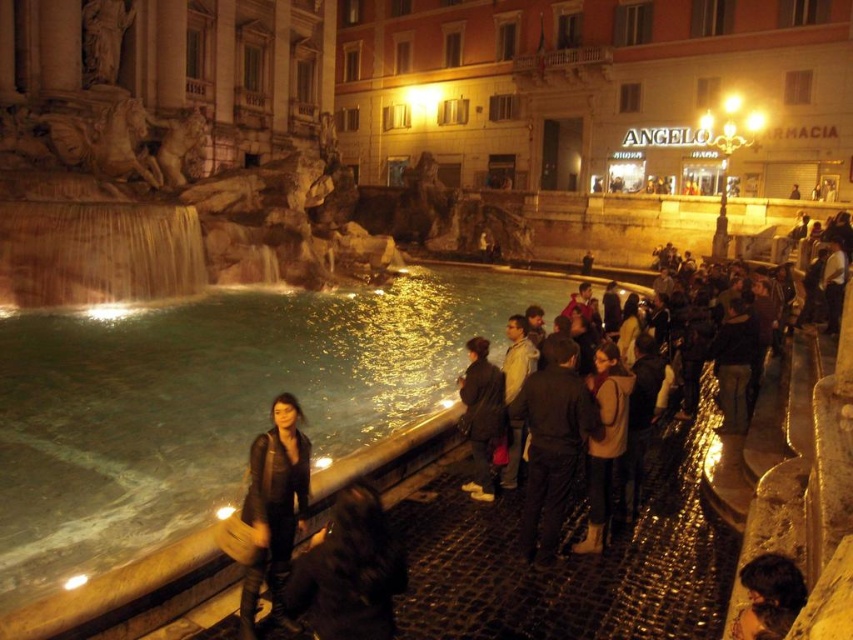
You are a photographer standing at the edge of the fountain. You notice two people wearing leather jackets in the crowd. One is wearing a leather jacket at lower center and the other has a leather jacket at center. Which person is standing closer to the fountain basin?

The leather jacket at lower center is much taller as leather jacket at center, so the person wearing the leather jacket at lower center is standing closer to the fountain basin.

You are a photographer standing at the edge of the fountain and want to take a photo that includes both the dark fabric jacket at lower center and the brown suede boots at center. Which object should you focus on first to ensure both are in clear view?

The dark fabric jacket at lower center is closer to the viewer than the brown suede boots at center, so you should focus on the dark fabric jacket at lower center first to ensure both are in clear view.